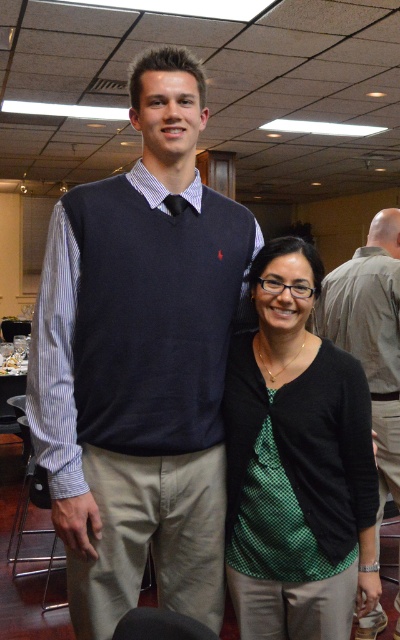
You are at a networking event and want to approach both people wearing dark blue sweater vest at center and dark blue sweater vest at upper left. Which one should you approach first if you want to talk to the person closer to the camera?

The dark blue sweater vest at upper left is closer to the camera than the dark blue sweater vest at center, so you should approach the dark blue sweater vest at upper left first.